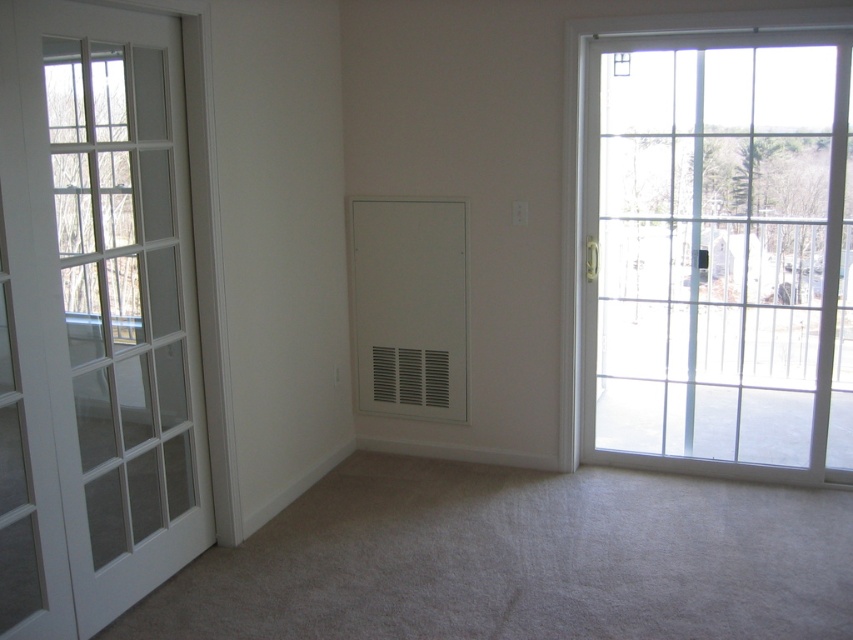
Does white glass door at left have a greater height compared to white matte vent at center?

Yes.

Is point (165, 150) in front of point (402, 243)?

Yes, it is in front of point (402, 243).

This screenshot has width=853, height=640. In order to click on white glass door at left in this screenshot , I will do `click(119, 300)`.

Measure the distance between clear glass door at right and white glass door at left.

The distance of clear glass door at right from white glass door at left is 3.01 meters.

Is clear glass door at right positioned behind white glass door at left?

Yes.

Who is more forward, (598,195) or (73,376)?

Point (73,376) is more forward.

Identify the location of clear glass door at right. (718, 253).

Who is positioned more to the left, clear glass door at right or white matte vent at center?

white matte vent at center

Is point (654, 285) farther from viewer compared to point (421, 362)?

Yes, point (654, 285) is farther from viewer.

Which is in front, point (682, 326) or point (419, 250)?

Point (419, 250) is more forward.

Where is `clear glass door at right`? The image size is (853, 640). clear glass door at right is located at coordinates (718, 253).